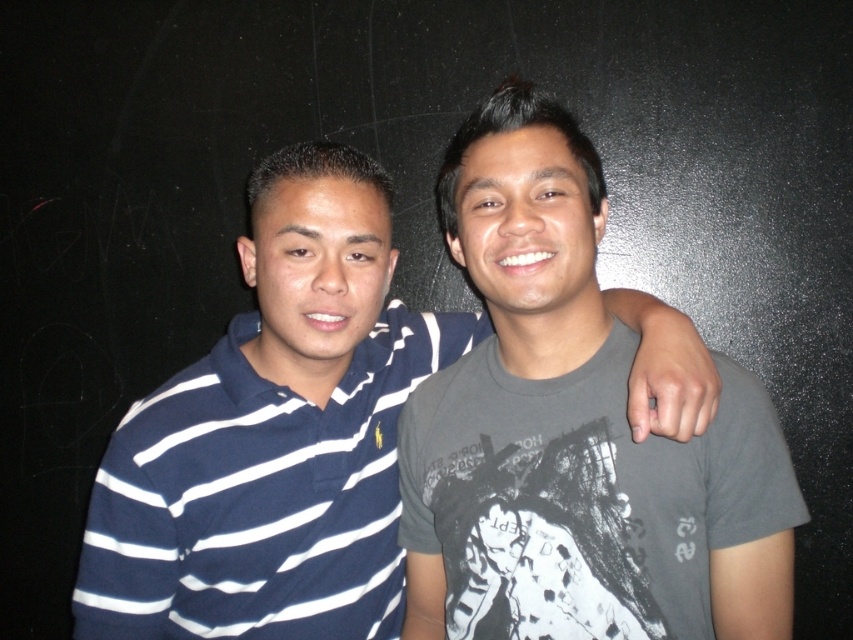
You are standing in front of the two people in the image. Which of the two points, point (415, 449) or point (234, 346), is closer to you?

Point (415, 449) is closer to you because it is in front of point (234, 346).